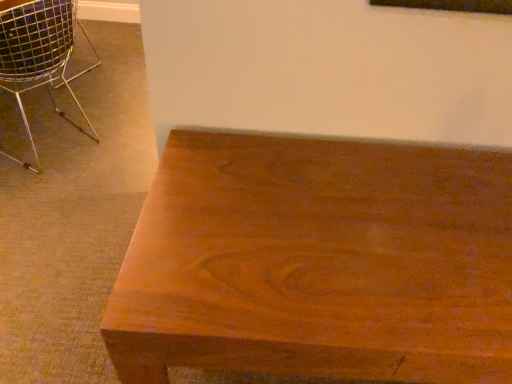
Where is `blank space situated above satin wood table at lower right (from a real-world perspective)`? blank space situated above satin wood table at lower right (from a real-world perspective) is located at coordinates (365, 217).